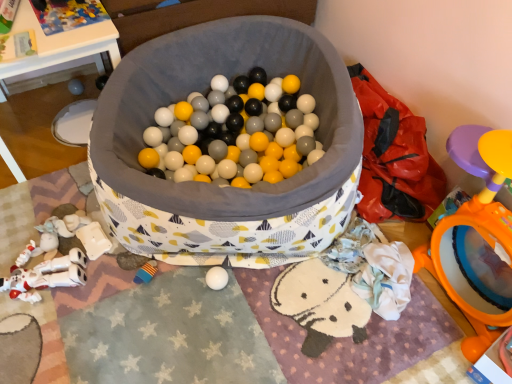
This screenshot has width=512, height=384. What are the coordinates of `unoccupied space behind white plush toy at lower left, the second toy positioned from the bottom` in the screenshot? It's located at (46, 213).